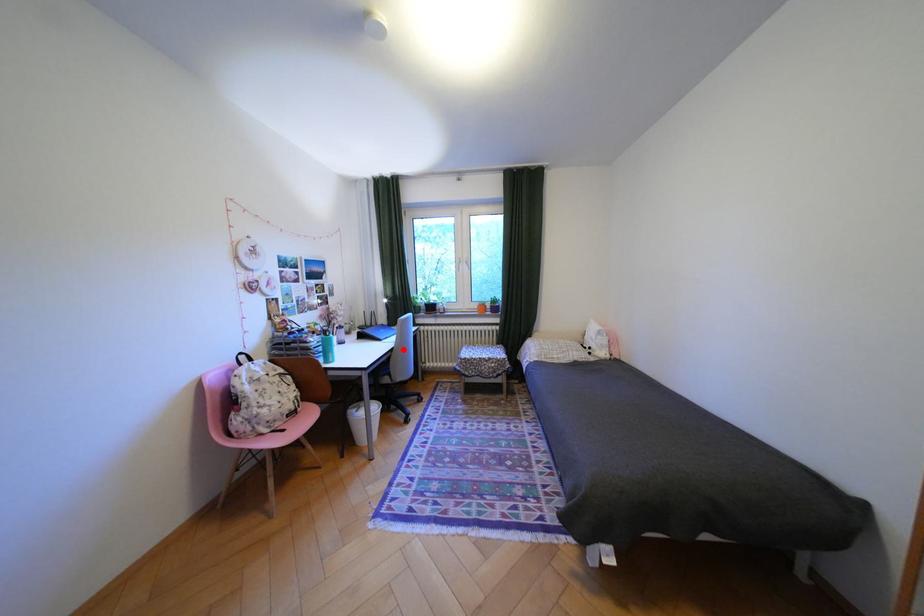
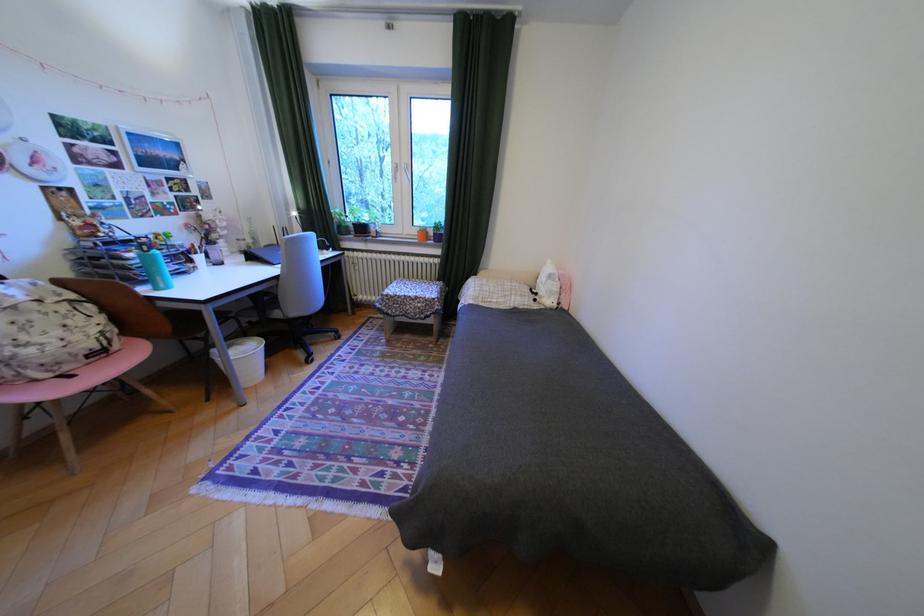
Question: A red point is marked in image1. In image2, is the corresponding 3D point closer to the camera or farther? Reply with the corresponding letter.

Choices:
 (A) The corresponding 3D point is closer.
 (B) The corresponding 3D point is farther.

Answer: (A)